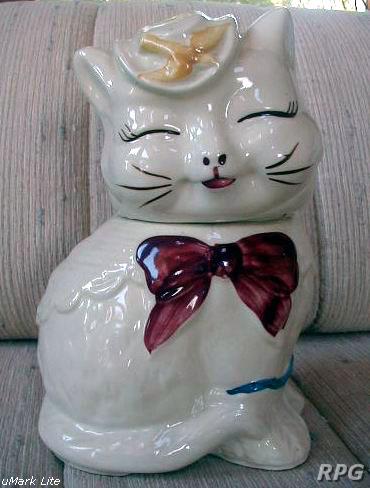
Locate an element on the screen. The image size is (370, 488). couch is located at coordinates (339, 407).